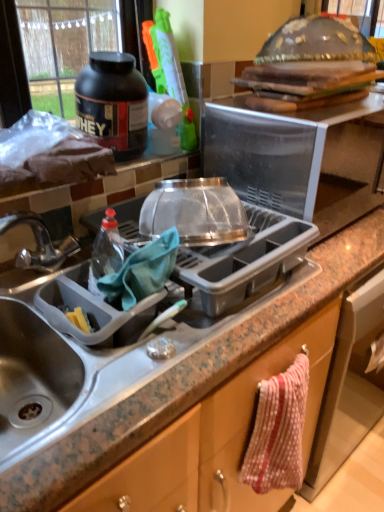
Question: Is metallic sink at left taller or shorter than granite gray sink at lower left?

Choices:
 (A) tall
 (B) short

Answer: (B)

Question: Is metallic sink at left inside or outside of granite gray sink at lower left?

Choices:
 (A) inside
 (B) outside

Answer: (A)

Question: Which of these objects is positioned closest to the metallic sink at left?

Choices:
 (A) black matte protein powder container at upper left
 (B) polka dot fabric towel at lower right
 (C) granite gray sink at lower left
 (D) clear plastic dish rack at center, the 2th appliance when ordered from top to bottom
 (E) transparent plastic microwave at upper center, marked as the 2th appliance in a bottom-to-top arrangement

Answer: (D)

Question: Which object is positioned farthest from the polka dot fabric towel at lower right?

Choices:
 (A) black matte protein powder container at upper left
 (B) granite gray sink at lower left
 (C) metallic sink at left
 (D) clear plastic dish rack at center, acting as the first appliance starting from the bottom
 (E) transparent plastic microwave at upper center, placed as the first appliance when sorted from top to bottom

Answer: (A)